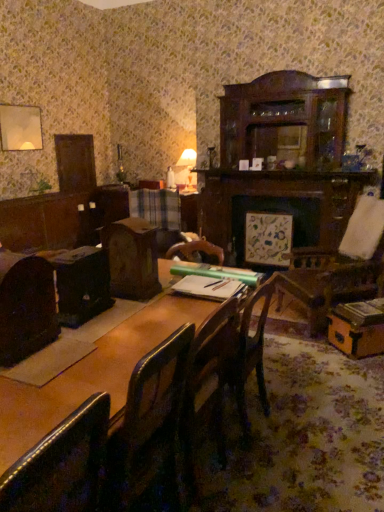
At what (x,y) coordinates should I click in order to perform the action: click on vacant area that is in front of dark brown leather chair at left, which is the 2th chair in front-to-back order. Please return your answer as a coordinate pair (x, y). This screenshot has width=384, height=512. Looking at the image, I should click on [x=31, y=374].